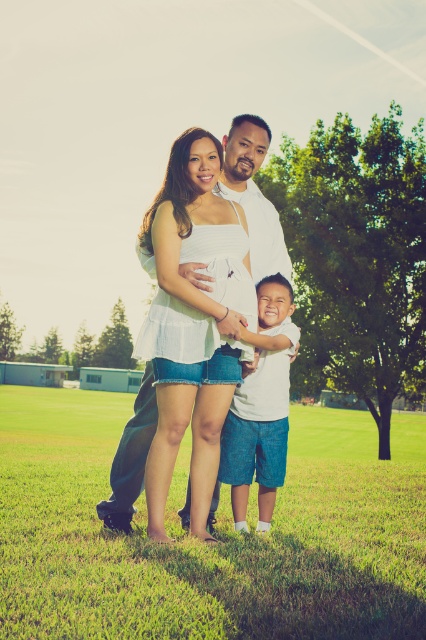
Is the position of green grass at lower center more distant than that of white matte dress at center?

No.

Does green grass at lower center appear on the right side of white matte dress at center?

No, green grass at lower center is not to the right of white matte dress at center.

The width and height of the screenshot is (426, 640). What are the coordinates of `green grass at lower center` in the screenshot? It's located at (218, 529).

Which is in front, point (388, 632) or point (282, 448)?

Point (388, 632) is in front.

What do you see at coordinates (218, 529) in the screenshot? The width and height of the screenshot is (426, 640). I see `green grass at lower center` at bounding box center [218, 529].

Find the location of `green grass at lower center`. green grass at lower center is located at coordinates (218, 529).

Which is above, white matte dress at center or white cotton shirt at center?

Positioned higher is white matte dress at center.

Is white matte dress at center smaller than white cotton shirt at center?

No, white matte dress at center is not smaller than white cotton shirt at center.

Who is more distant from viewer, [201,218] or [259,472]?

Positioned behind is point [259,472].

In order to click on white matte dress at center in this screenshot , I will do `click(166, 438)`.